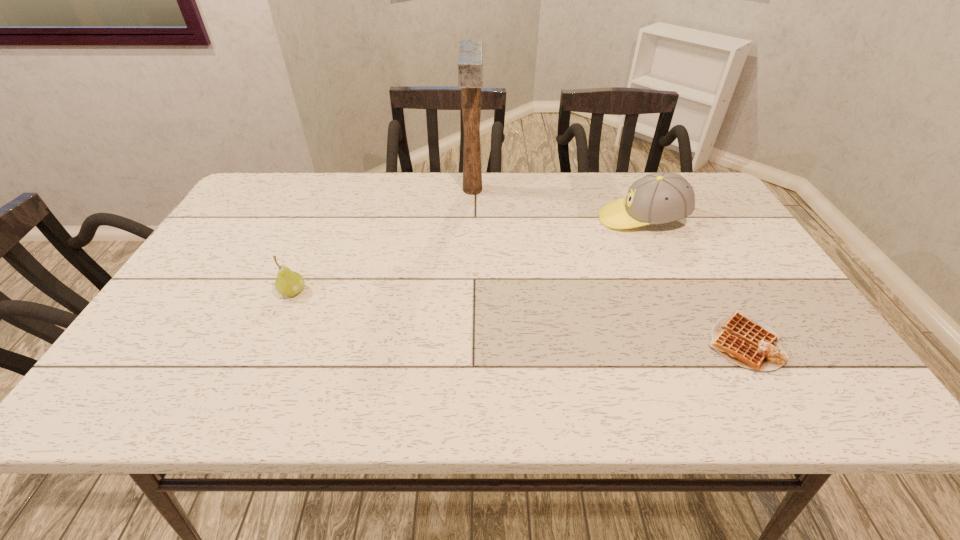
The width and height of the screenshot is (960, 540). In order to click on free space located on the front-facing side of the baseball cap in this screenshot , I will do `click(519, 219)`.

Identify the location of vacant area situated 0.320m on the right of the second nearest object. The image size is (960, 540). (439, 292).

What are the coordinates of `vacant position located 0.320m on the back of the waffle` in the screenshot? It's located at (682, 232).

You are a GUI agent. You are given a task and a screenshot of the screen. Output one action in this format:
    pyautogui.click(x=<x>, y=<y>)
    Task: Click on the mallet at the far edge
    Image resolution: width=960 pixels, height=540 pixels.
    Given the screenshot: What is the action you would take?
    pyautogui.click(x=470, y=52)

The image size is (960, 540). What are the coordinates of `baseball cap that is positioned at the far edge` in the screenshot? It's located at (663, 197).

This screenshot has height=540, width=960. Identify the location of object located at the near edge. (752, 344).

Find the location of a particular element. baseball cap present at the right edge is located at coordinates (663, 197).

Image resolution: width=960 pixels, height=540 pixels. What are the coordinates of `waffle that is at the right edge` in the screenshot? It's located at pyautogui.click(x=752, y=344).

I want to click on object at the far right corner, so click(663, 197).

Locate an element on the screen. object at the near right corner is located at coordinates (752, 344).